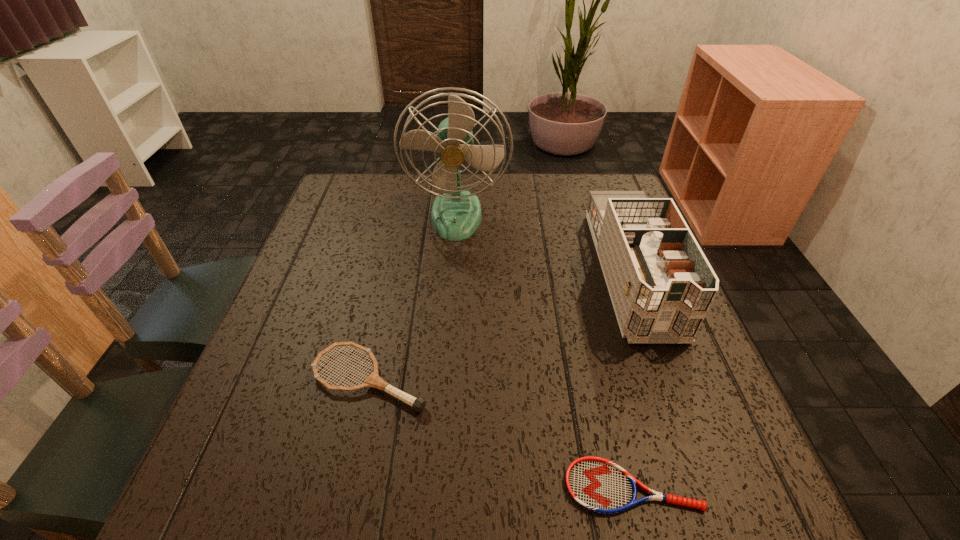
Where is `fan that is at the far edge`? The image size is (960, 540). fan that is at the far edge is located at coordinates (455, 215).

The image size is (960, 540). Identify the location of dollhouse that is at the far edge. (661, 285).

The height and width of the screenshot is (540, 960). What are the coordinates of `object at the near edge` in the screenshot? It's located at (596, 484).

Where is `object located in the left edge section of the desktop`? object located in the left edge section of the desktop is located at coordinates (373, 380).

The width and height of the screenshot is (960, 540). I want to click on dollhouse at the right edge, so click(x=661, y=285).

Where is `tennis racket that is at the right edge`? The image size is (960, 540). tennis racket that is at the right edge is located at coordinates (596, 484).

Locate an element on the screen. This screenshot has width=960, height=540. object at the far right corner is located at coordinates (661, 285).

Where is `object that is at the near right corner`? The height and width of the screenshot is (540, 960). object that is at the near right corner is located at coordinates (596, 484).

Where is `blank space at the far edge of the desktop`? blank space at the far edge of the desktop is located at coordinates (490, 182).

Find the location of a particular element. free space at the near edge is located at coordinates [x=408, y=504].